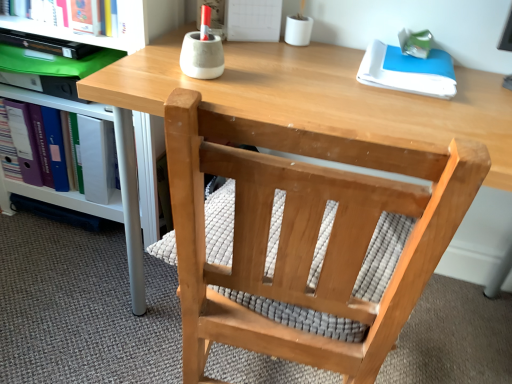
I want to click on vacant area that is situated to the right of white paper at upper right, so click(x=481, y=87).